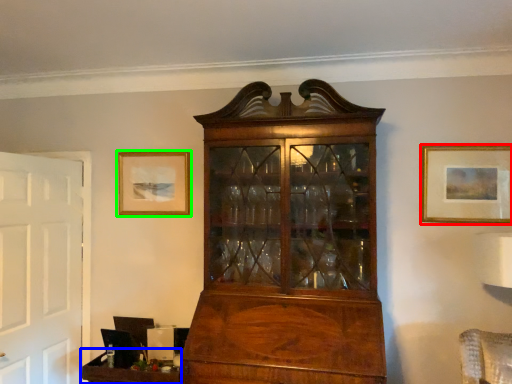
Question: Which object is the farthest from picture frame (highlighted by a red box)? Choose among these: table (highlighted by a blue box) or picture frame (highlighted by a green box).

Choices:
 (A) table
 (B) picture frame

Answer: (A)